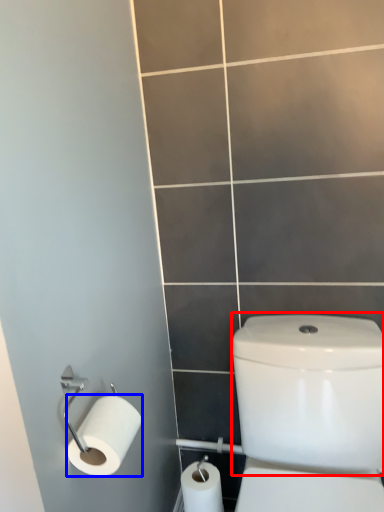
Question: Which object is further to the camera taking this photo, water tank (highlighted by a red box) or toilet paper (highlighted by a blue box)?

Choices:
 (A) water tank
 (B) toilet paper

Answer: (B)